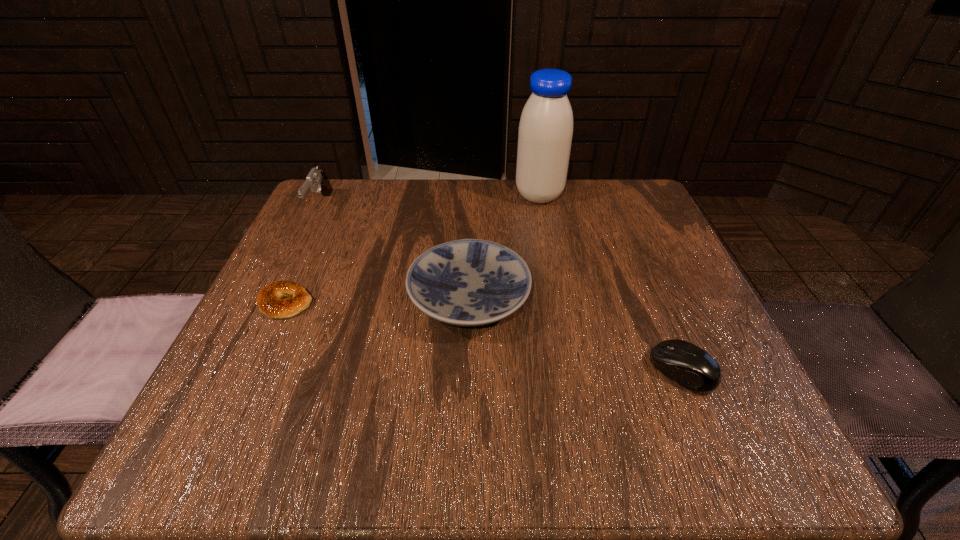
I want to click on the tallest object, so (x=545, y=133).

Identify the location of the fourth shortest object. Image resolution: width=960 pixels, height=540 pixels. (316, 178).

At what (x,y) coordinates should I click in order to perform the action: click on plate. Please return your answer as a coordinate pair (x, y). This screenshot has width=960, height=540. Looking at the image, I should click on (469, 282).

Locate an element on the screen. This screenshot has height=540, width=960. the fourth tallest object is located at coordinates (688, 365).

This screenshot has height=540, width=960. What are the coordinates of `the nearest object` in the screenshot? It's located at (688, 365).

Find the location of a particular element. bagel is located at coordinates (269, 301).

Image resolution: width=960 pixels, height=540 pixels. I want to click on free space located 0.210m on the front of the tallest object, so click(552, 266).

Locate an element on the screen. The image size is (960, 540). vacant space located at the muzzle of the second tallest object is located at coordinates pos(254,345).

Identify the location of free space located 0.310m on the right of the plate. (693, 299).

What are the coordinates of `free region located on the left of the nearest object` in the screenshot? It's located at (564, 370).